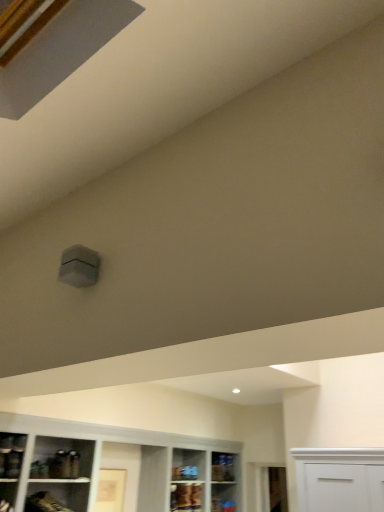
Looking at this image, measure the distance between point (9, 469) and camera.

Point (9, 469) is 2.93 meters from camera.

Where is `clear glass shelf at lower center, the 1th shelf when ordered from back to front`? clear glass shelf at lower center, the 1th shelf when ordered from back to front is located at coordinates (223, 467).

Between matte brown cabinet at lower center and matte glass shelf at lower left, acting as the first shelf starting from the top, which one appears on the right side from the viewer's perspective?

Positioned to the right is matte brown cabinet at lower center.

Which of these two, matte brown cabinet at lower center or matte glass shelf at lower left, which is the third shelf from back to front, is thinner?

Thinner between the two is matte glass shelf at lower left, which is the third shelf from back to front.

From the image's perspective, is matte brown cabinet at lower center under matte glass shelf at lower left, the 3th shelf in the bottom-to-top sequence?

Correct, matte brown cabinet at lower center appears lower than matte glass shelf at lower left, the 3th shelf in the bottom-to-top sequence, in the image.

Is matte brown cabinet at lower center oriented towards matte brown shelf at lower left, acting as the second shelf starting from the left?

No.

Who is smaller, matte brown cabinet at lower center or matte brown shelf at lower left, which appears as the second shelf when viewed from the right?

matte brown cabinet at lower center.

From a real-world perspective, is matte brown cabinet at lower center above or below matte brown shelf at lower left, the second shelf when ordered from front to back?

From a real-world perspective, matte brown cabinet at lower center is physically above matte brown shelf at lower left, the second shelf when ordered from front to back.

Does matte glass shelf at lower left, acting as the first shelf starting from the top, contain matte brown shelf at lower left, which is the 2th shelf from bottom to top?

No, matte brown shelf at lower left, which is the 2th shelf from bottom to top, is not inside matte glass shelf at lower left, acting as the first shelf starting from the top.

Is matte glass shelf at lower left, marked as the 3th shelf in a right-to-left arrangement, to the left of matte brown shelf at lower left, the second shelf when ordered from front to back, from the viewer's perspective?

Correct, you'll find matte glass shelf at lower left, marked as the 3th shelf in a right-to-left arrangement, to the left of matte brown shelf at lower left, the second shelf when ordered from front to back.

From a real-world perspective, is matte glass shelf at lower left, which is the third shelf from back to front, above or below matte brown shelf at lower left, which appears as the second shelf when viewed from the right?

matte glass shelf at lower left, which is the third shelf from back to front, is situated higher than matte brown shelf at lower left, which appears as the second shelf when viewed from the right, in the real world.

From a real-world perspective, which is physically below, matte brown shelf at lower left, the 2th shelf positioned from the back, or matte brown cabinet at lower center?

From a 3D spatial view, matte brown shelf at lower left, the 2th shelf positioned from the back, is below.

In the scene shown: In the image, is matte brown shelf at lower left, the second shelf when ordered from front to back, positioned in front of or behind matte brown cabinet at lower center?

matte brown shelf at lower left, the second shelf when ordered from front to back, is in front of matte brown cabinet at lower center.

Which of these two, matte brown shelf at lower left, which is the 2th shelf from bottom to top, or matte brown cabinet at lower center, is wider?

matte brown shelf at lower left, which is the 2th shelf from bottom to top.

Is matte brown shelf at lower left, acting as the second shelf starting from the left, with matte glass shelf at lower left, the 3th shelf in the bottom-to-top sequence?

No, matte brown shelf at lower left, acting as the second shelf starting from the left, is not making contact with matte glass shelf at lower left, the 3th shelf in the bottom-to-top sequence.

Can you tell me how much matte brown shelf at lower left, which is the 2th shelf from bottom to top, and matte glass shelf at lower left, arranged as the first shelf when viewed from the front, differ in facing direction?

There is a 6.28-degree angle between the facing directions of matte brown shelf at lower left, which is the 2th shelf from bottom to top, and matte glass shelf at lower left, arranged as the first shelf when viewed from the front.

Between matte brown shelf at lower left, the second shelf when ordered from front to back, and matte glass shelf at lower left, which appears as the first shelf when viewed from the left, which one has smaller width?

Thinner between the two is matte glass shelf at lower left, which appears as the first shelf when viewed from the left.

Which object is closer to the camera, matte brown shelf at lower left, the second shelf when ordered from top to bottom, or matte glass shelf at lower left, which appears as the first shelf when viewed from the left?

matte glass shelf at lower left, which appears as the first shelf when viewed from the left, is more forward.

Does clear glass shelf at lower center, the 3th shelf when ordered from front to back, have a larger size compared to matte glass shelf at lower left, acting as the first shelf starting from the top?

Actually, clear glass shelf at lower center, the 3th shelf when ordered from front to back, might be smaller than matte glass shelf at lower left, acting as the first shelf starting from the top.

In the scene shown: Is clear glass shelf at lower center, the 1th shelf when ordered from back to front, positioned beyond the bounds of matte glass shelf at lower left, which appears as the first shelf when viewed from the left?

clear glass shelf at lower center, the 1th shelf when ordered from back to front, is positioned outside matte glass shelf at lower left, which appears as the first shelf when viewed from the left.

Considering the relative positions of clear glass shelf at lower center, positioned as the 3th shelf in top-to-bottom order, and matte glass shelf at lower left, acting as the first shelf starting from the top, in the image provided, is clear glass shelf at lower center, positioned as the 3th shelf in top-to-bottom order, to the right of matte glass shelf at lower left, acting as the first shelf starting from the top, from the viewer's perspective?

Indeed, clear glass shelf at lower center, positioned as the 3th shelf in top-to-bottom order, is positioned on the right side of matte glass shelf at lower left, acting as the first shelf starting from the top.

From the picture: Which object is further away from the camera taking this photo, clear glass shelf at lower center, the 3th shelf when ordered from front to back, or matte glass shelf at lower left, the 3th shelf in the bottom-to-top sequence?

clear glass shelf at lower center, the 3th shelf when ordered from front to back.

Looking at the image, does matte glass shelf at lower left, the 3th shelf in the bottom-to-top sequence, seem bigger or smaller compared to clear glass shelf at lower center, the 3th shelf positioned from the left?

Clearly, matte glass shelf at lower left, the 3th shelf in the bottom-to-top sequence, is larger in size than clear glass shelf at lower center, the 3th shelf positioned from the left.

From the image's perspective, is matte glass shelf at lower left, which appears as the first shelf when viewed from the left, above clear glass shelf at lower center, the 1th shelf when ordered from back to front?

→ Yes, from the image's perspective, matte glass shelf at lower left, which appears as the first shelf when viewed from the left, is above clear glass shelf at lower center, the 1th shelf when ordered from back to front.

Is matte glass shelf at lower left, which is the third shelf from back to front, in contact with clear glass shelf at lower center, positioned as the 3th shelf in top-to-bottom order?

No, matte glass shelf at lower left, which is the third shelf from back to front, is not making contact with clear glass shelf at lower center, positioned as the 3th shelf in top-to-bottom order.

This screenshot has height=512, width=384. I want to click on the 2nd shelf above the matte brown cabinet at lower center (from the image's perspective), so click(11, 455).

You are a GUI agent. You are given a task and a screenshot of the screen. Output one action in this format:
    pyautogui.click(x=<x>, y=<y>)
    Task: Click on the cabinet behind the matte brown shelf at lower left, the second shelf when ordered from front to back
    The height and width of the screenshot is (512, 384).
    Given the screenshot: What is the action you would take?
    pyautogui.click(x=186, y=496)

From the image, which object appears to be nearer to matte brown shelf at lower left, acting as the second shelf starting from the left, clear glass shelf at lower center, placed as the 1th shelf when sorted from right to left, or matte glass shelf at lower left, arranged as the first shelf when viewed from the front?

Among the two, matte glass shelf at lower left, arranged as the first shelf when viewed from the front, is located nearer to matte brown shelf at lower left, acting as the second shelf starting from the left.

Estimate the real-world distances between objects in this image. Which object is closer to matte brown cabinet at lower center, clear glass shelf at lower center, marked as the first shelf in a bottom-to-top arrangement, or matte glass shelf at lower left, which is the third shelf from back to front?

Among the two, clear glass shelf at lower center, marked as the first shelf in a bottom-to-top arrangement, is located nearer to matte brown cabinet at lower center.

Considering their positions, is matte glass shelf at lower left, the 3th shelf in the bottom-to-top sequence, positioned closer to clear glass shelf at lower center, positioned as the 3th shelf in top-to-bottom order, than matte brown cabinet at lower center?

Among the two, matte brown cabinet at lower center is located nearer to clear glass shelf at lower center, positioned as the 3th shelf in top-to-bottom order.

From the image, which object appears to be farther from matte glass shelf at lower left, the 3th shelf in the bottom-to-top sequence, matte brown cabinet at lower center or clear glass shelf at lower center, the 3th shelf positioned from the left?

Among the two, clear glass shelf at lower center, the 3th shelf positioned from the left, is located further to matte glass shelf at lower left, the 3th shelf in the bottom-to-top sequence.

Looking at the image, which one is located further to matte brown cabinet at lower center, matte brown shelf at lower left, which appears as the second shelf when viewed from the right, or clear glass shelf at lower center, the 1th shelf when ordered from back to front?

matte brown shelf at lower left, which appears as the second shelf when viewed from the right, is further to matte brown cabinet at lower center.

Considering their positions, is clear glass shelf at lower center, the 3th shelf positioned from the left, positioned further to matte glass shelf at lower left, arranged as the first shelf when viewed from the front, than matte brown shelf at lower left, which is the 2th shelf from bottom to top?

Among the two, clear glass shelf at lower center, the 3th shelf positioned from the left, is located further to matte glass shelf at lower left, arranged as the first shelf when viewed from the front.

Estimate the real-world distances between objects in this image. Which object is closer to matte brown cabinet at lower center, matte glass shelf at lower left, which appears as the first shelf when viewed from the left, or matte brown shelf at lower left, the second shelf when ordered from front to back?

Among the two, matte brown shelf at lower left, the second shelf when ordered from front to back, is located nearer to matte brown cabinet at lower center.

Looking at the image, which one is located closer to matte brown shelf at lower left, acting as the second shelf starting from the left, matte glass shelf at lower left, the 3th shelf in the bottom-to-top sequence, or clear glass shelf at lower center, marked as the first shelf in a bottom-to-top arrangement?

Among the two, matte glass shelf at lower left, the 3th shelf in the bottom-to-top sequence, is located nearer to matte brown shelf at lower left, acting as the second shelf starting from the left.

The height and width of the screenshot is (512, 384). I want to click on shelf located between matte glass shelf at lower left, acting as the first shelf starting from the top, and clear glass shelf at lower center, placed as the 1th shelf when sorted from right to left, in the depth direction, so click(57, 497).

Locate an element on the screen. cabinet located between matte brown shelf at lower left, the second shelf when ordered from front to back, and clear glass shelf at lower center, the 3th shelf when ordered from front to back, in the depth direction is located at coordinates (186, 496).

What are the coordinates of `cabinet between matte glass shelf at lower left, which is the third shelf from back to front, and clear glass shelf at lower center, the 3th shelf positioned from the left, along the z-axis` in the screenshot? It's located at (186, 496).

This screenshot has width=384, height=512. What are the coordinates of `shelf between matte glass shelf at lower left, the 3th shelf in the bottom-to-top sequence, and matte brown cabinet at lower center from front to back` in the screenshot? It's located at (57, 497).